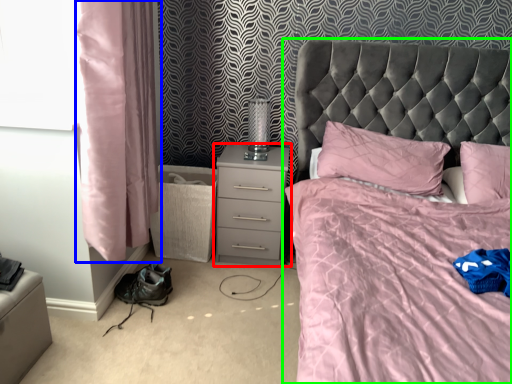
Question: Considering the real-world distances, which object is closest to nightstand (highlighted by a red box)? curtain (highlighted by a blue box) or bed (highlighted by a green box).

Choices:
 (A) curtain
 (B) bed

Answer: (B)